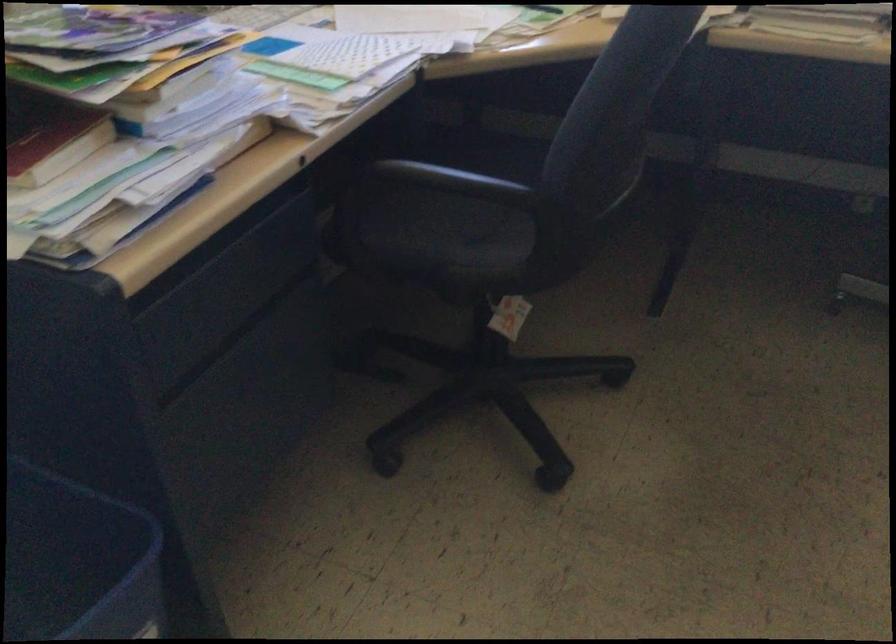
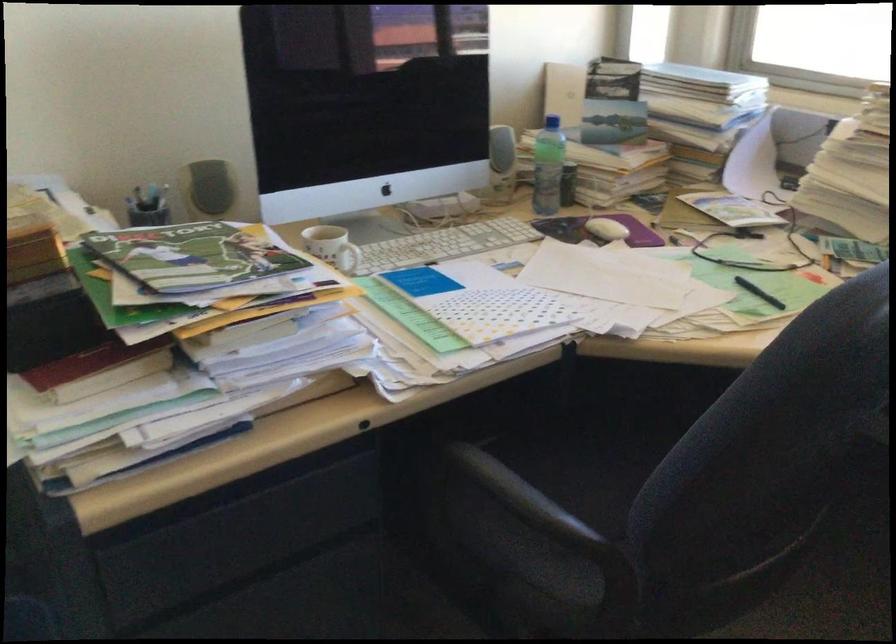
Question: The first image is from the beginning of the video and the second image is from the end. How did the camera likely rotate when shooting the video?

Choices:
 (A) Left
 (B) Right
 (C) Up
 (D) Down

Answer: (A)